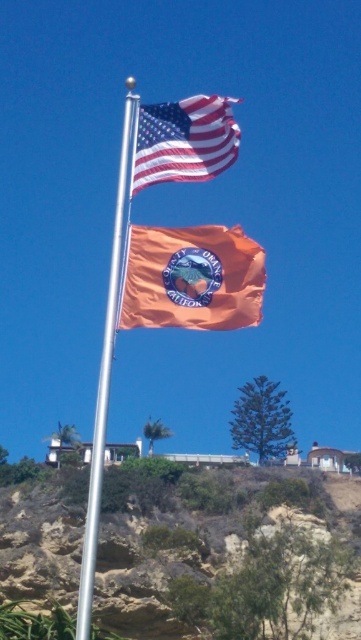
Between point (263, 536) and point (132, 326), which one is positioned in front?

Point (132, 326)

Can you confirm if brown rocky cliff at lower center is positioned above orange matte flag at center?

Incorrect, brown rocky cliff at lower center is not positioned above orange matte flag at center.

Does point (337, 609) lie in front of point (184, 230)?

No.

The width and height of the screenshot is (361, 640). I want to click on brown rocky cliff at lower center, so click(x=231, y=556).

Between point (145, 243) and point (171, 144), which one is positioned in front?

Point (145, 243)

Between point (167, 288) and point (180, 177), which one is positioned in front?

Point (167, 288) is in front.

Where is `orange matte flag at center`? Image resolution: width=361 pixels, height=640 pixels. orange matte flag at center is located at coordinates (192, 278).

Which is below, orange matte flag at center or silver metallic flag pole at center?

Positioned lower is silver metallic flag pole at center.

Image resolution: width=361 pixels, height=640 pixels. Identify the location of orange matte flag at center. (192, 278).

Who is more forward, (232, 321) or (132, 109)?

Positioned in front is point (232, 321).

Identify the location of orange matte flag at center. The height and width of the screenshot is (640, 361). (192, 278).